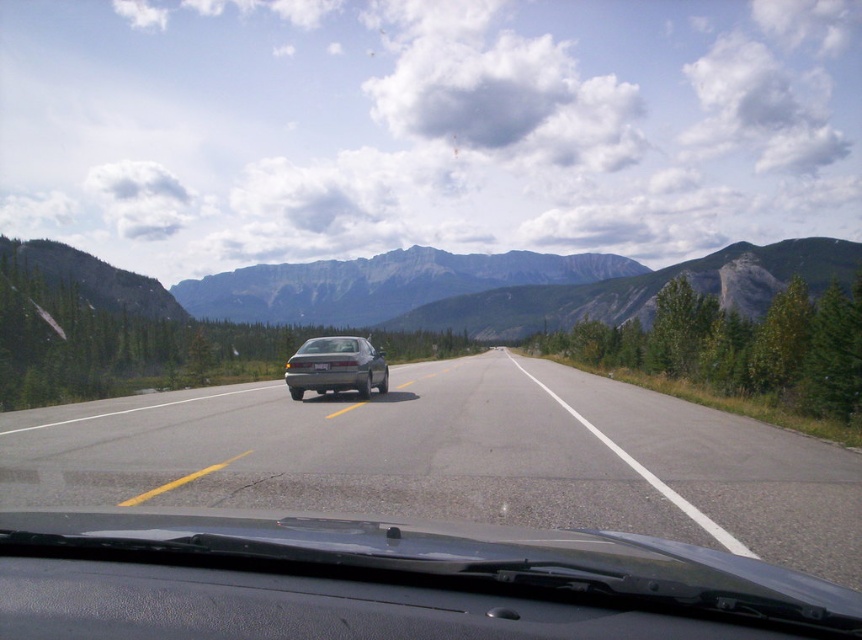
Question: Which point is farther from the camera taking this photo?

Choices:
 (A) (265, 285)
 (B) (315, 388)
 (C) (354, 346)
 (D) (614, 419)

Answer: (A)

Question: Is gray rock mountain at center positioned in front of satin silver sedan at center?

Choices:
 (A) yes
 (B) no

Answer: (B)

Question: Considering the relative positions of black plastic dashboard at center and satin silver sedan at center in the image provided, where is black plastic dashboard at center located with respect to satin silver sedan at center?

Choices:
 (A) right
 (B) left

Answer: (A)

Question: Which object is closer to the camera taking this photo?

Choices:
 (A) matte gray car at center
 (B) satin silver sedan at center
 (C) black plastic dashboard at center

Answer: (C)

Question: Does gray asphalt highway at center have a smaller size compared to gray rock mountain at center?

Choices:
 (A) yes
 (B) no

Answer: (A)

Question: Considering the real-world distances, which object is closest to the gray asphalt highway at center?

Choices:
 (A) black plastic dashboard at center
 (B) matte gray car at center

Answer: (B)